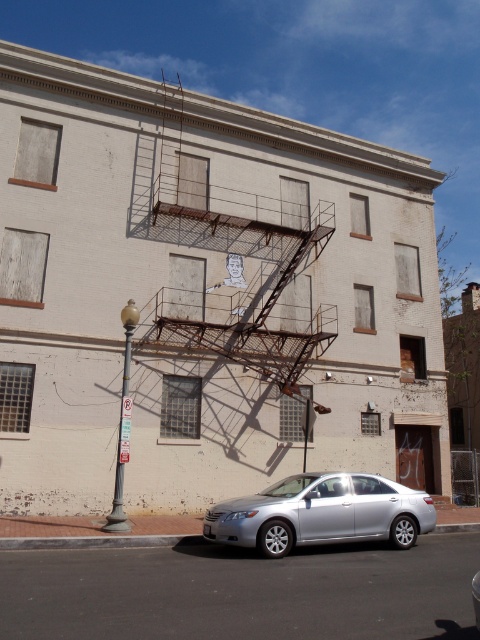
Is point (227, 209) more distant than point (127, 445)?

Yes, point (227, 209) is behind point (127, 445).

What do you see at coordinates (230, 256) in the screenshot?
I see `rusty metal fire escape at center` at bounding box center [230, 256].

The image size is (480, 640). I want to click on rusty metal fire escape at center, so click(x=230, y=256).

Locate an element on the screen. This screenshot has height=640, width=480. rusty metal fire escape at center is located at coordinates (230, 256).

Is silver metallic sedan at lower center bigger than metallic streetlamp at left?

Indeed, silver metallic sedan at lower center has a larger size compared to metallic streetlamp at left.

Is point (354, 531) positioned in front of point (134, 320)?

Yes, point (354, 531) is in front of point (134, 320).

Find the location of a particular element. This screenshot has width=480, height=640. silver metallic sedan at lower center is located at coordinates (322, 513).

Is rusty metal fire escape at center wider than silver metallic sedan at lower center?

Indeed, rusty metal fire escape at center has a greater width compared to silver metallic sedan at lower center.

Is rusty metal fire escape at center taller than silver metallic sedan at lower center?

Yes, rusty metal fire escape at center is taller than silver metallic sedan at lower center.

Is point (286, 252) positioned before point (249, 522)?

No, (286, 252) is behind (249, 522).

The image size is (480, 640). Identify the location of rusty metal fire escape at center. (230, 256).